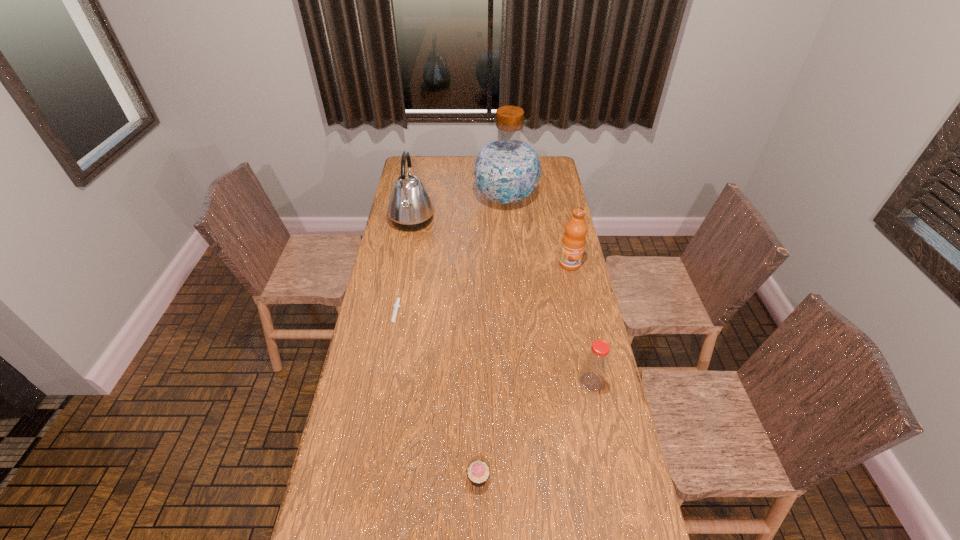
Image resolution: width=960 pixels, height=540 pixels. In order to click on blank space located 0.220m on the left of the water jug in this screenshot , I will do `click(429, 198)`.

Where is `vacant area situated from the spout of the second tallest object`? This screenshot has height=540, width=960. vacant area situated from the spout of the second tallest object is located at coordinates pyautogui.click(x=491, y=221).

The image size is (960, 540). In order to click on free point located on the label side of the fruit juice in this screenshot , I will do `click(574, 285)`.

Where is `blank space located 0.270m on the left of the second nearest object`? This screenshot has width=960, height=540. blank space located 0.270m on the left of the second nearest object is located at coordinates (497, 382).

Image resolution: width=960 pixels, height=540 pixels. Find the location of `free space located on the back of the nearest object`. free space located on the back of the nearest object is located at coordinates (479, 437).

Where is `free region located on the right of the fourth farthest object`? free region located on the right of the fourth farthest object is located at coordinates (468, 315).

This screenshot has width=960, height=540. What are the coordinates of `kettle that is at the left edge` in the screenshot? It's located at (410, 208).

Where is `syringe located at the left edge`? This screenshot has height=540, width=960. syringe located at the left edge is located at coordinates coord(396,305).

Image resolution: width=960 pixels, height=540 pixels. In order to click on water jug that is positioned at the right edge in this screenshot , I will do `click(507, 170)`.

At what (x,y) coordinates should I click in order to perform the action: click on fruit juice that is at the right edge. Please return your answer as a coordinate pair (x, y). Looking at the image, I should click on (574, 239).